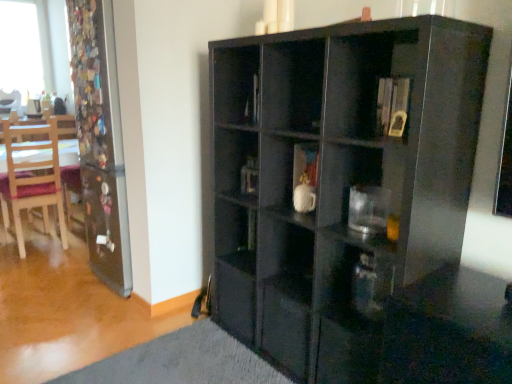
Question: Is transparent glass screen door at left located within wooden chair at left, the 1th chair positioned from the right?

Choices:
 (A) no
 (B) yes

Answer: (A)

Question: Can you confirm if wooden chair at left, arranged as the second chair when viewed from the back, is shorter than transparent glass screen door at left?

Choices:
 (A) yes
 (B) no

Answer: (A)

Question: Is wooden chair at left, arranged as the second chair when viewed from the back, in front of transparent glass screen door at left?

Choices:
 (A) no
 (B) yes

Answer: (A)

Question: Does wooden chair at left, the 1th chair positioned from the right, have a greater width compared to transparent glass screen door at left?

Choices:
 (A) no
 (B) yes

Answer: (B)

Question: Is wooden chair at left, marked as the first chair in a front-to-back arrangement, further to camera compared to transparent glass screen door at left?

Choices:
 (A) no
 (B) yes

Answer: (B)

Question: Is wooden chair at left, marked as the first chair in a front-to-back arrangement, spatially inside wooden chair at left, which ranks as the 1th chair in top-to-bottom order, or outside of it?

Choices:
 (A) inside
 (B) outside

Answer: (B)

Question: From a real-world perspective, is wooden chair at left, marked as the first chair in a front-to-back arrangement, physically located above or below wooden chair at left, the 1th chair viewed from the left?

Choices:
 (A) above
 (B) below

Answer: (B)

Question: From the image's perspective, relative to wooden chair at left, which ranks as the 1th chair in top-to-bottom order, is wooden chair at left, the second chair from the top, above or below?

Choices:
 (A) below
 (B) above

Answer: (A)

Question: Considering their positions, is wooden chair at left, the second chair from the top, located in front of or behind wooden chair at left, the 1th chair positioned from the back?

Choices:
 (A) front
 (B) behind

Answer: (A)

Question: Considering the positions of point (7, 99) and point (94, 162), is point (7, 99) closer or farther from the camera than point (94, 162)?

Choices:
 (A) farther
 (B) closer

Answer: (A)

Question: From a real-world perspective, is wooden chair at left, the second chair from the right, physically located above or below transparent glass screen door at left?

Choices:
 (A) below
 (B) above

Answer: (B)

Question: In terms of height, does wooden chair at left, the 1th chair viewed from the left, look taller or shorter compared to transparent glass screen door at left?

Choices:
 (A) tall
 (B) short

Answer: (B)

Question: Looking at their shapes, would you say wooden chair at left, the second chair viewed from the front, is wider or thinner than transparent glass screen door at left?

Choices:
 (A) wide
 (B) thin

Answer: (B)

Question: Does point (48, 132) appear closer or farther from the camera than point (370, 195)?

Choices:
 (A) farther
 (B) closer

Answer: (A)

Question: From a real-world perspective, relative to transparent glass coffee cup at center-right, is wooden chair at left, the 1th chair from the bottom, vertically above or below?

Choices:
 (A) below
 (B) above

Answer: (A)